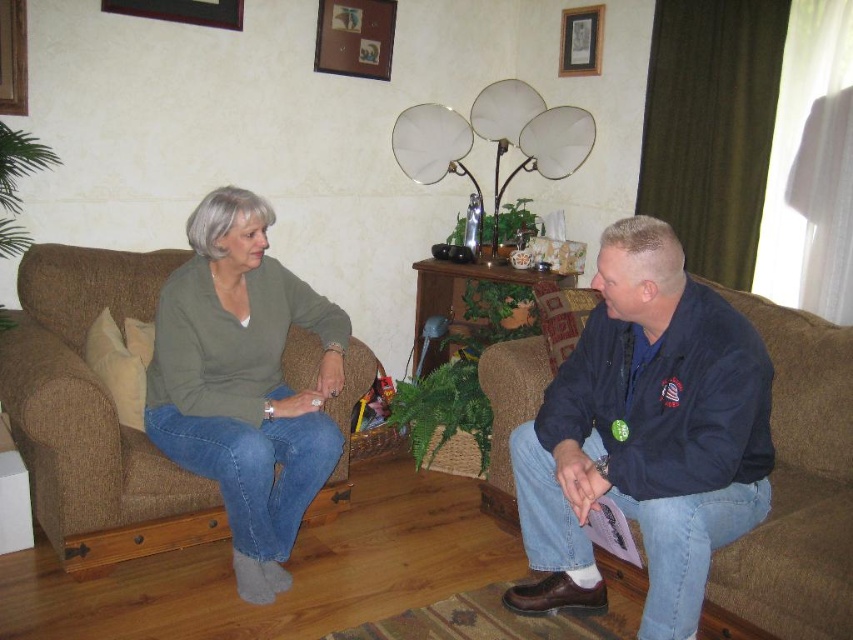
In the living room scene, there is a dark blue fabric jacket at right and a brown fabric couch at left. Which object is positioned to the right of the other?

The dark blue fabric jacket at right is positioned to the right of the brown fabric couch at left.

You are standing in the living room and want to move from point A to point B. Point A is at coordinates point (732, 349) and point B is at coordinates point (335, 451). Which direction should you move to go from point A to point B?

To move from point A at coordinates point (732, 349) to point B at coordinates point (335, 451), you should move towards the lower right direction since point B is located lower and to the right of point A.

You are standing in the living room and want to place a small table between the two people. The table requires a space of at least 0.5 meters between the dark blue fabric jacket at right and the woman on the left. Can you determine if there is enough space?

The dark blue fabric jacket at right is located at point (x=645, y=435). Since the exact distance between the two individuals isn without the necessary coordinates for the woman on the left, it is impossible to determine if the space is sufficient for the table.